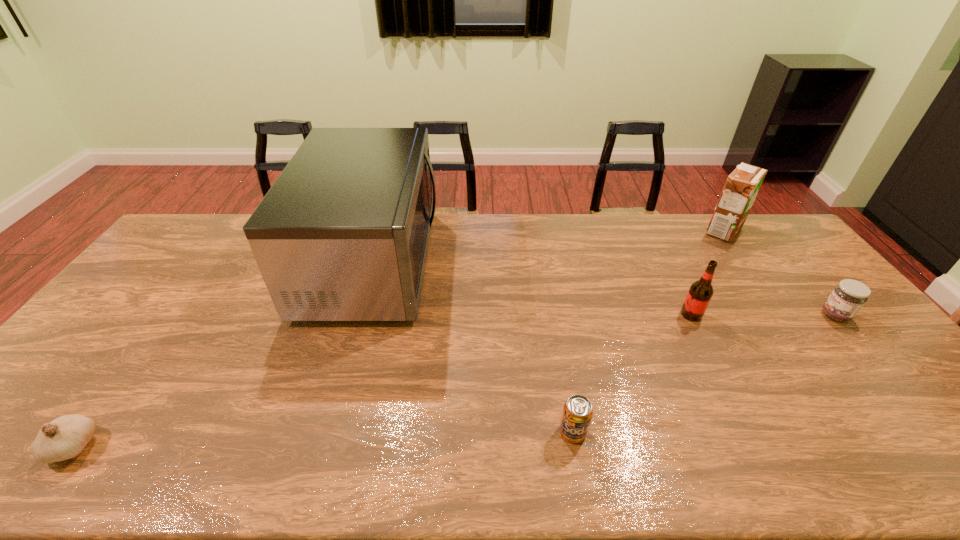
This screenshot has height=540, width=960. I want to click on free space located 0.100m on the straw side of the carton, so click(x=675, y=231).

Identify the location of free region located on the straw side of the carton. The height and width of the screenshot is (540, 960). (629, 231).

Locate an element on the screen. blank space located on the straw side of the carton is located at coordinates [651, 231].

Locate an element on the screen. vacant position located 0.380m on the front of the third object from right to left is located at coordinates (756, 445).

Image resolution: width=960 pixels, height=540 pixels. I want to click on free space located on the front label of the rightmost object, so click(x=764, y=315).

You are a GUI agent. You are given a task and a screenshot of the screen. Output one action in this format:
    pyautogui.click(x=<x>, y=<y>)
    Task: Click on the vacant space located on the front label of the rightmost object
    The height and width of the screenshot is (540, 960).
    Given the screenshot: What is the action you would take?
    pyautogui.click(x=761, y=315)

At what (x,y) coordinates should I click in order to perform the action: click on vacant space situated on the front label of the rightmost object. Please return your answer as a coordinate pair (x, y). The image size is (960, 540). Looking at the image, I should click on (741, 315).

The image size is (960, 540). Identify the location of vacant space located 0.070m on the left of the soda can. (529, 432).

At what (x,y) coordinates should I click in order to perform the action: click on blank space located 0.190m on the right of the leftmost object. Please return your answer as a coordinate pair (x, y). This screenshot has height=540, width=960. Looking at the image, I should click on (181, 446).

The height and width of the screenshot is (540, 960). I want to click on microwave oven situated at the far edge, so point(342,235).